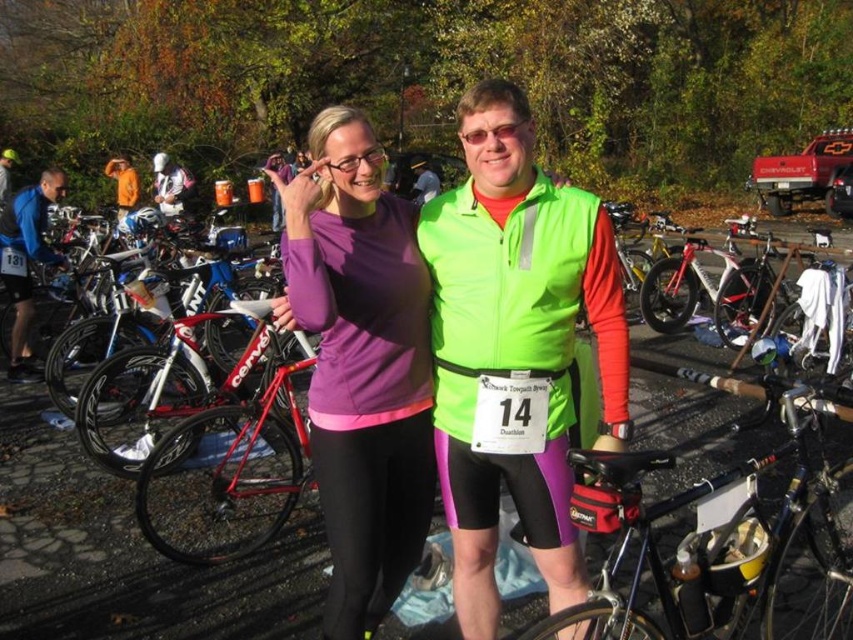
Question: Which point appears farthest from the camera in this image?

Choices:
 (A) (480, 115)
 (B) (704, 593)

Answer: (B)

Question: Which point is closer to the camera taking this photo?

Choices:
 (A) (599, 248)
 (B) (28, 292)
 (C) (340, 260)
 (D) (674, 465)

Answer: (D)

Question: Is neon green vest at center further to camera compared to black matte bicycle at center?

Choices:
 (A) no
 (B) yes

Answer: (B)

Question: Which of the following is the farthest from the observer?

Choices:
 (A) purple matte long-sleeve shirt at center
 (B) neon green vest at center

Answer: (A)

Question: Is neon green vest at center wider than shiny black bike at center?

Choices:
 (A) yes
 (B) no

Answer: (B)

Question: Is shiny black bike at center closer to the viewer compared to brushed metal bicycle at left?

Choices:
 (A) yes
 (B) no

Answer: (A)